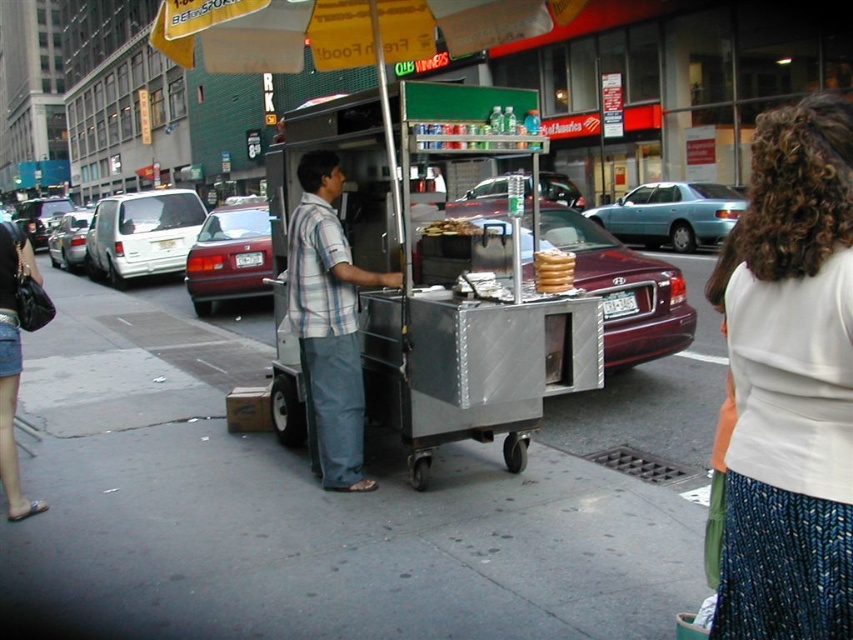
You are a customer looking at the food vendor cart. You notice two items of clothing in the scene. Which clothing item is nearer to you, the white knit sweater at upper right or the striped cotton shirt at center?

The white knit sweater at upper right is closer to the viewer than the striped cotton shirt at center.

You are a customer at the food cart and notice two items in the image. One is the white knit sweater at upper right and the other is the golden brown bread at center. Which item is narrower in width?

The white knit sweater at upper right is thinner than the golden brown bread at center, so the white knit sweater at upper right is narrower in width.